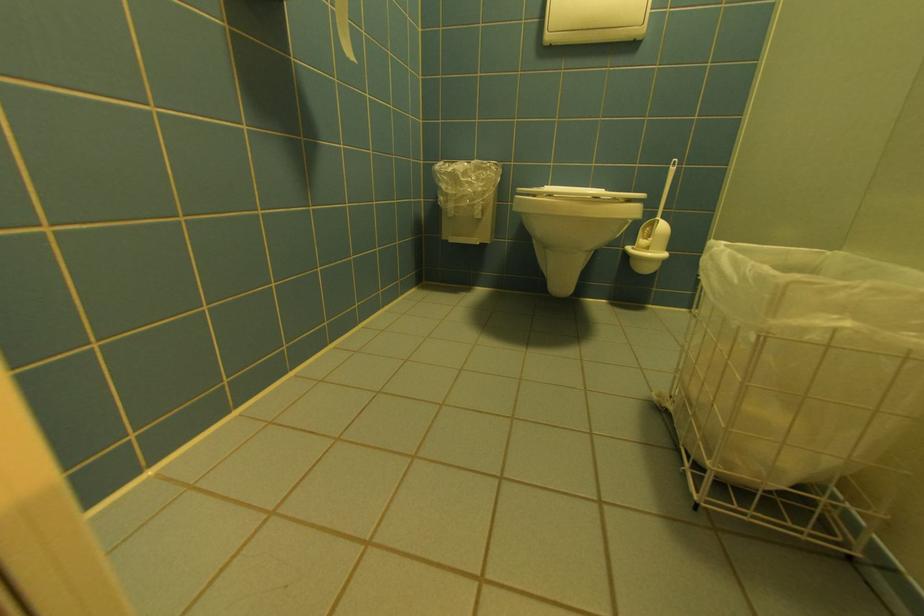
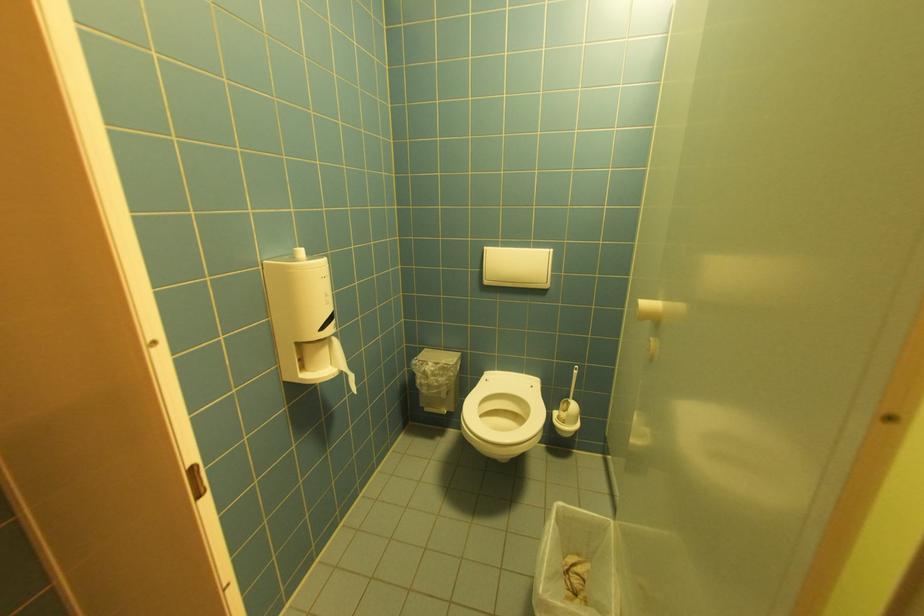
Locate, in the second image, the point that corresponds to the point at 554,38 in the first image.

(492, 283)